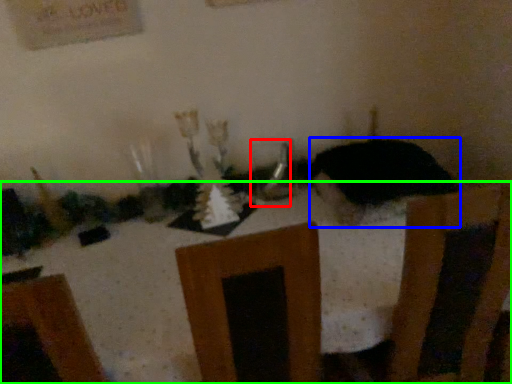
Question: Which object is the farthest from tableware (highlighted by a red box)? Choose among these: animal (highlighted by a blue box) or furniture (highlighted by a green box).

Choices:
 (A) animal
 (B) furniture

Answer: (B)